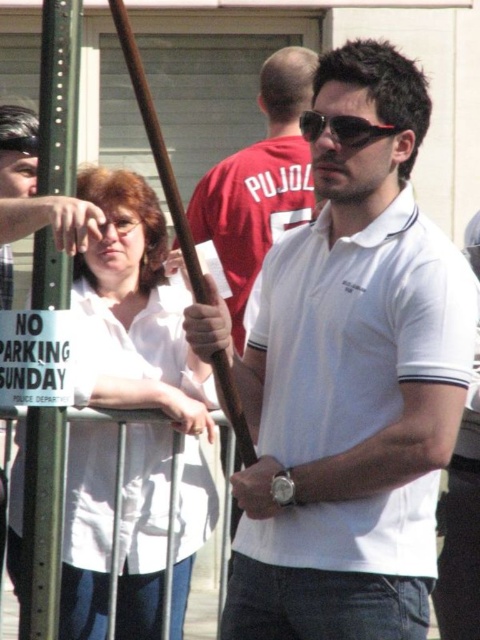
You are a fashion designer observing the man in the image. You need to determine if the white cotton polo shirt at center can fit into a storage box designed for sunglasses at center. Can it fit based on their thickness?

The white cotton polo shirt at center is thinner than sunglasses at center, so it can fit into the storage box designed for sunglasses at center.